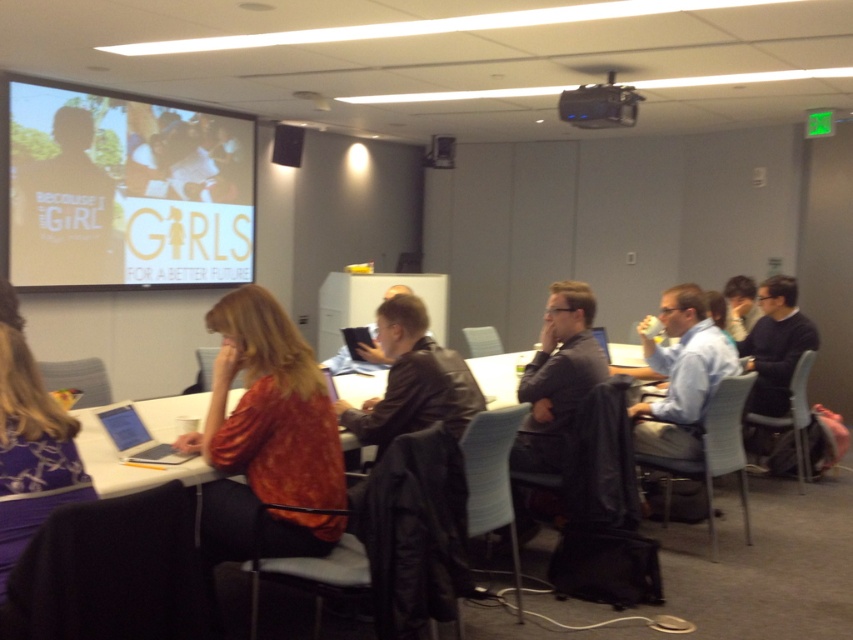
You are a technician who needs to connect the matte black laptop at center to the black plastic projector at upper center using a 3.5 meter HDMI cable. Will the cable be long enough to reach?

The black plastic projector at upper center is 3.76 meters away from the matte black laptop at center. The 3.5 meter HDMI cable is shorter than the required distance, so it will not be long enough to reach.

You are a photographer in the conference room and want to take a photo of the orange textured shirt at center without the matte white projector screen at upper left blocking it. How should you position yourself relative to the shirt?

Move to a position behind the orange textured shirt at center so that it is between you and the matte white projector screen at upper left. Since the orange textured shirt at center is behind the matte white projector screen at upper left, positioning yourself behind the shirt will allow you to capture it without the screen blocking the view.

In the conference room scene, there is a matte white projector screen at upper left and a leather jacket at center. From the perspective of someone sitting at the table, which object is positioned to the left?

The matte white projector screen at upper left is to the left of the leather jacket at center, so the matte white projector screen at upper left is positioned to the left.